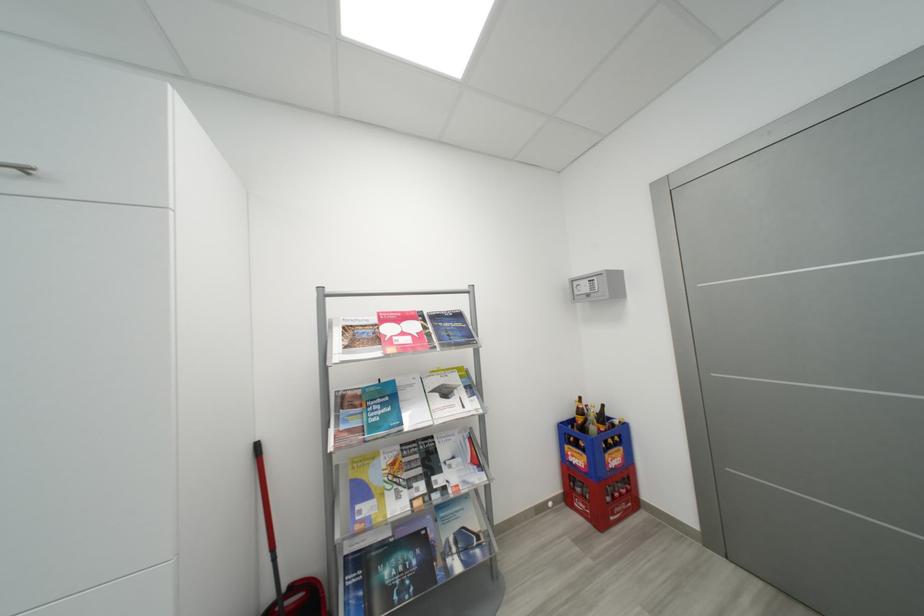
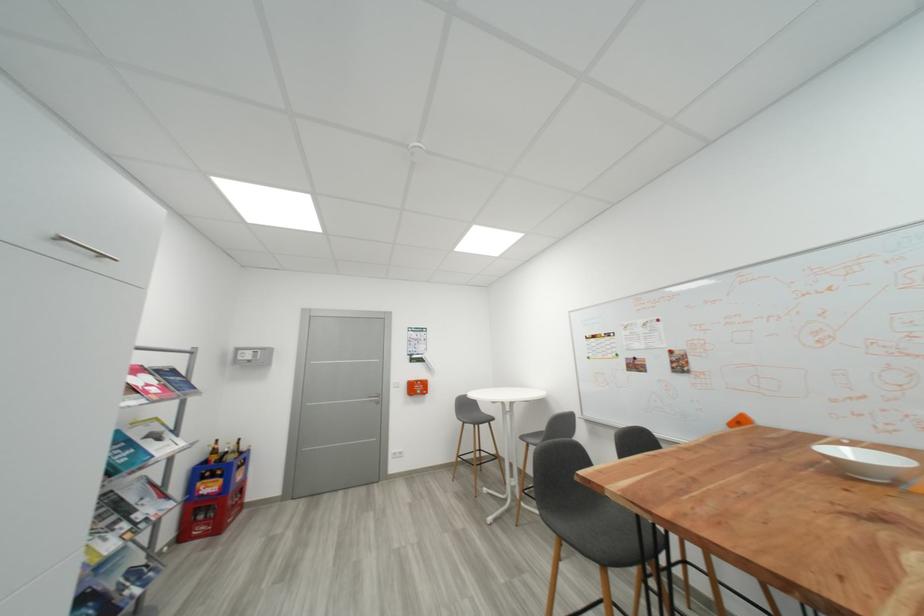
Locate, in the second image, the point that corresponds to [592,421] in the first image.

(234, 454)